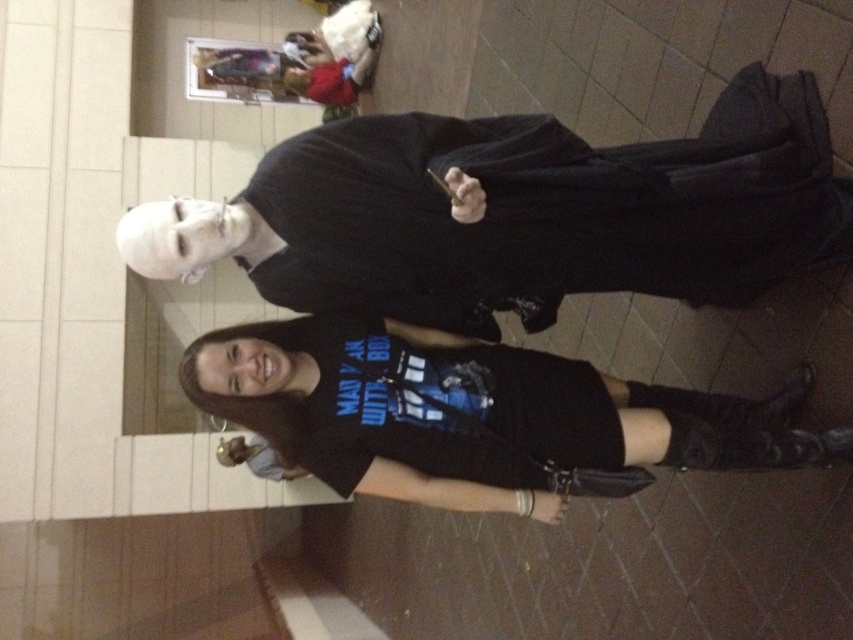
Question: In this image, where is black matte robe at upper center located relative to black matte t-shirt at center?

Choices:
 (A) below
 (B) above

Answer: (B)

Question: Can you confirm if black matte robe at upper center is positioned below black matte t-shirt at center?

Choices:
 (A) no
 (B) yes

Answer: (A)

Question: Which point is farther to the camera?

Choices:
 (A) black matte robe at upper center
 (B) black matte t-shirt at center

Answer: (B)

Question: Which of the following is the closest to the observer?

Choices:
 (A) (374, 292)
 (B) (849, 448)

Answer: (B)

Question: Which point appears farthest from the camera in this image?

Choices:
 (A) (796, 128)
 (B) (299, 435)

Answer: (A)

Question: In this image, where is black matte robe at upper center located relative to black matte t-shirt at center?

Choices:
 (A) above
 (B) below

Answer: (A)